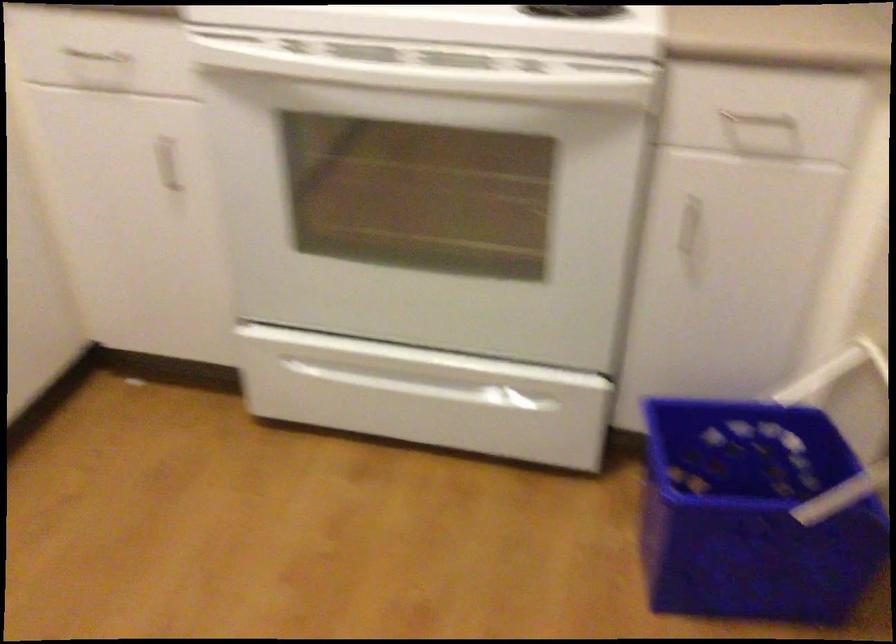
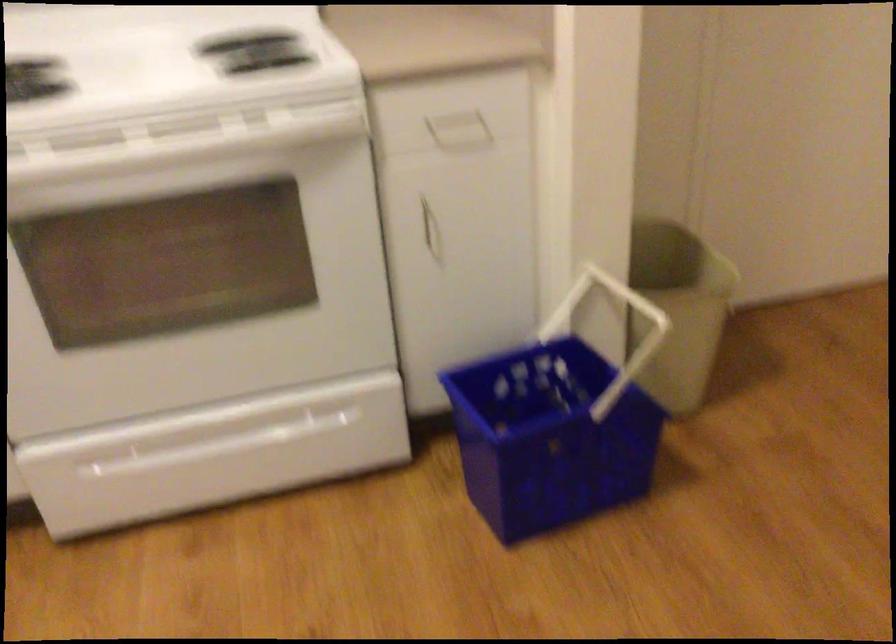
What movement of the cameraman would produce the second image?

The movement direction of the cameraman is left, backward.